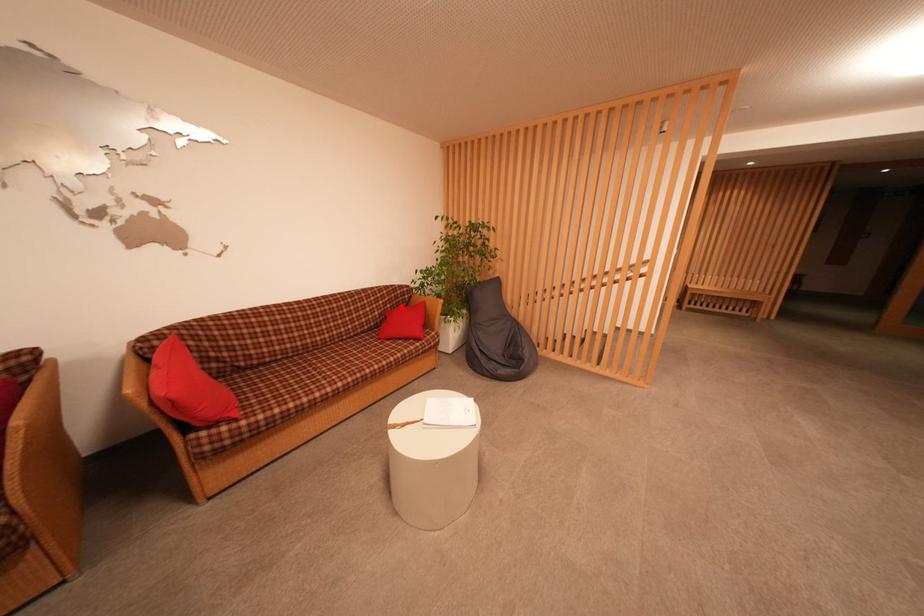
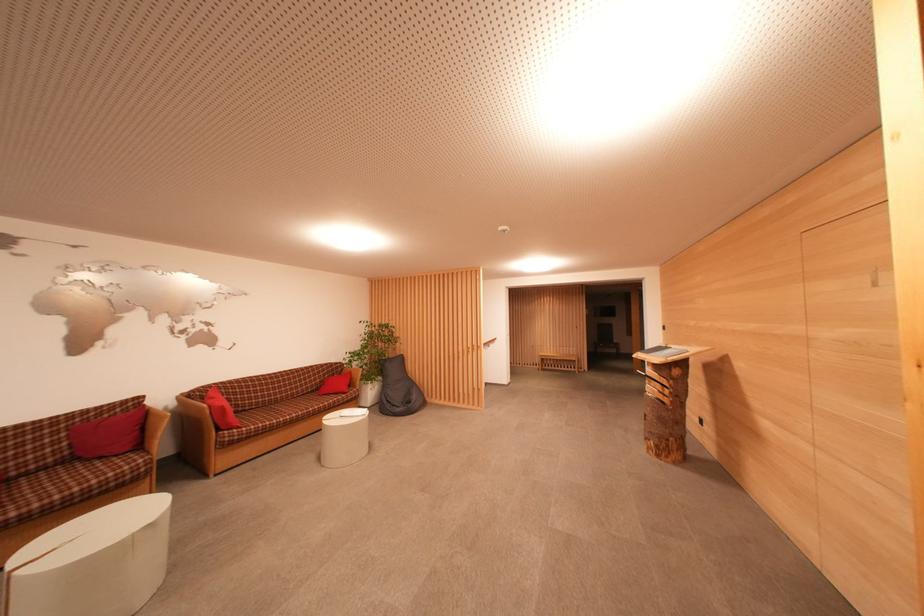
Question: I am providing you with two images of the same scene from different viewpoints. A red point is marked on the first image. Can you still see the location of the red point in image 2?

Choices:
 (A) Yes
 (B) No

Answer: (A)